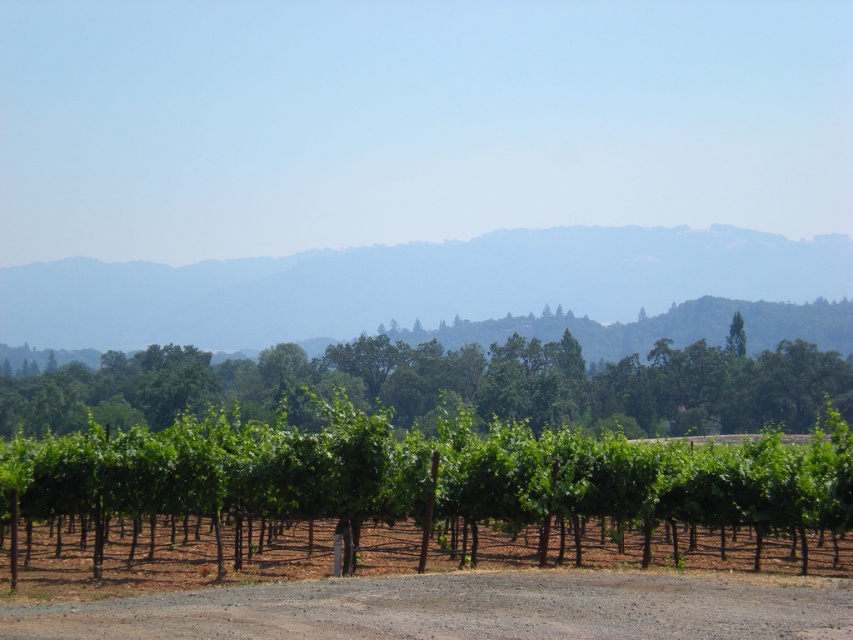
You are standing at the entrance of the vineyard and want to locate the green leafy tree at center. According to the coordinates provided, in which direction should you look to find it?

The green leafy tree at center is located at coordinates point (x=448, y=385). Since the x coordinate is 0.602, which is to the right of the center point, and the y coordinate is 0.526, which is slightly above the center point, you should look towards the upper right direction to find it.